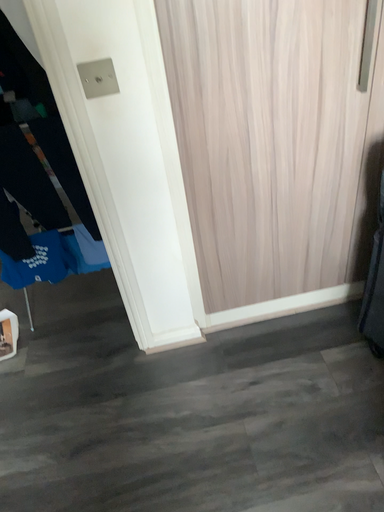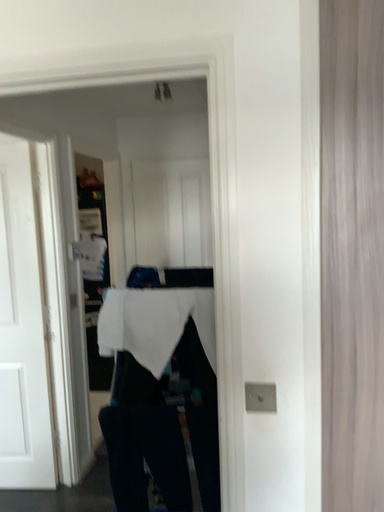
Question: Which way did the camera rotate in the video?

Choices:
 (A) rotated right
 (B) rotated left

Answer: (B)